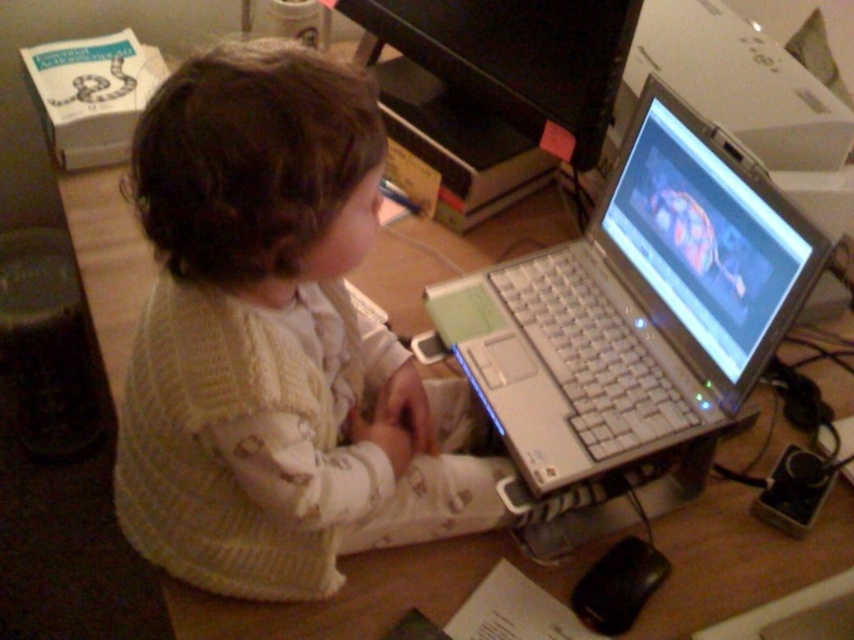
The child is trying to place a new book on the desk between the white knitted sweater at center and the silver metallic laptop at center. Considering their heights, which object should be placed closer to the edge of the desk to prevent the book from falling off?

The white knitted sweater at center is taller than the silver metallic laptop at center, so placing the book closer to the white knitted sweater at center would provide a more stable support, preventing it from sliding off the desk edge.